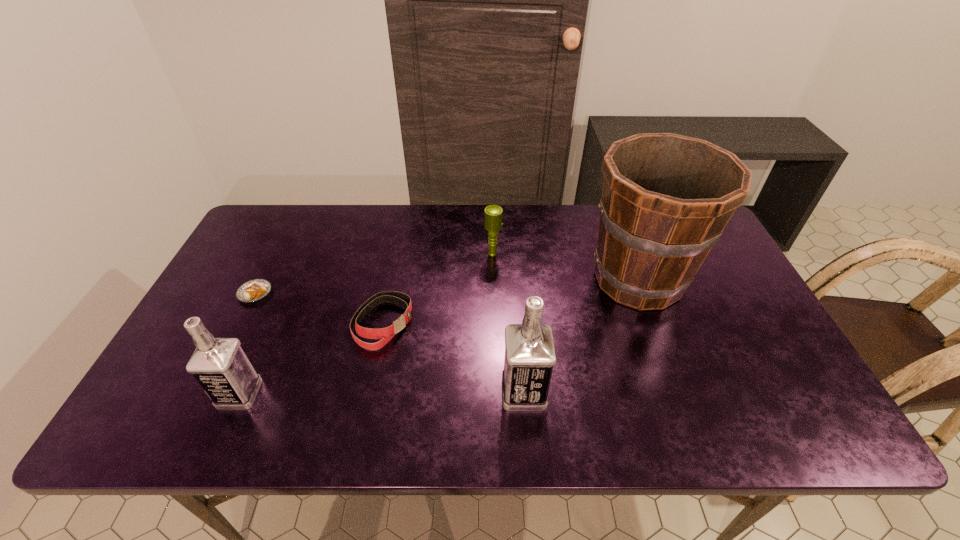
Find the location of a particular element. The height and width of the screenshot is (540, 960). free space that satisfies the following two spatial constraints: 1. on the front side of the third shortest object; 2. on the front label of the left vodka is located at coordinates [497, 394].

Identify the location of vacant area in the image that satisfies the following two spatial constraints: 1. on the front side of the fourth tallest object; 2. on the front label of the left vodka. This screenshot has width=960, height=540. (497, 394).

Find the location of a particular element. free space that satisfies the following two spatial constraints: 1. on the front side of the dog collar; 2. on the left side of the shortest object is located at coordinates (240, 323).

Where is `free space that satisfies the following two spatial constraints: 1. on the back side of the third shortest object; 2. on the left side of the second shortest object`? The height and width of the screenshot is (540, 960). free space that satisfies the following two spatial constraints: 1. on the back side of the third shortest object; 2. on the left side of the second shortest object is located at coordinates (397, 254).

Where is `free space that satisfies the following two spatial constraints: 1. on the front side of the rightmost object; 2. on the front label of the left vodka`? Image resolution: width=960 pixels, height=540 pixels. free space that satisfies the following two spatial constraints: 1. on the front side of the rightmost object; 2. on the front label of the left vodka is located at coordinates (681, 394).